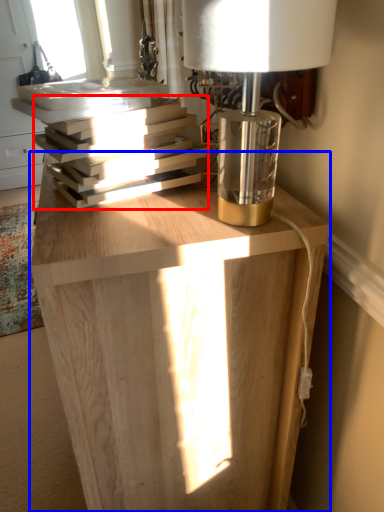
Question: Among these objects, which one is farthest to the camera, book (highlighted by a red box) or table (highlighted by a blue box)?

Choices:
 (A) book
 (B) table

Answer: (A)